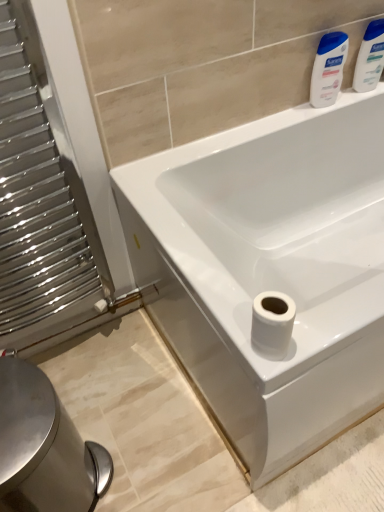
Question: Is white glossy lotion at upper right, positioned as the 2th cleaning product in right-to-left order, at the right side of white glossy bathtub at center?

Choices:
 (A) yes
 (B) no

Answer: (B)

Question: From the image's perspective, is white glossy lotion at upper right, which is counted as the 1th cleaning product, starting from the left, below white glossy bathtub at center?

Choices:
 (A) yes
 (B) no

Answer: (B)

Question: Is white glossy bathtub at center a part of white glossy lotion at upper right, which is counted as the 1th cleaning product, starting from the left?

Choices:
 (A) no
 (B) yes

Answer: (A)

Question: Is white glossy lotion at upper right, positioned as the 2th cleaning product in right-to-left order, facing towards white glossy bathtub at center?

Choices:
 (A) no
 (B) yes

Answer: (A)

Question: Considering the relative sizes of white glossy lotion at upper right, positioned as the 2th cleaning product in right-to-left order, and white glossy bathtub at center in the image provided, is white glossy lotion at upper right, positioned as the 2th cleaning product in right-to-left order, thinner than white glossy bathtub at center?

Choices:
 (A) yes
 (B) no

Answer: (A)

Question: Is polished metal radiator at left to the left or to the right of silver metallic bidet at lower left in the image?

Choices:
 (A) left
 (B) right

Answer: (A)

Question: Considering the positions of polished metal radiator at left and silver metallic bidet at lower left in the image, is polished metal radiator at left wider or thinner than silver metallic bidet at lower left?

Choices:
 (A) wide
 (B) thin

Answer: (B)

Question: Is polished metal radiator at left bigger or smaller than silver metallic bidet at lower left?

Choices:
 (A) small
 (B) big

Answer: (A)

Question: Which is correct: polished metal radiator at left is inside silver metallic bidet at lower left, or outside of it?

Choices:
 (A) outside
 (B) inside

Answer: (A)

Question: From a real-world perspective, is silver metallic bidet at lower left positioned above or below white glossy bathtub at center?

Choices:
 (A) below
 (B) above

Answer: (A)

Question: From the image's perspective, is silver metallic bidet at lower left positioned above or below white glossy bathtub at center?

Choices:
 (A) below
 (B) above

Answer: (A)

Question: Based on their sizes in the image, would you say silver metallic bidet at lower left is bigger or smaller than white glossy bathtub at center?

Choices:
 (A) big
 (B) small

Answer: (B)

Question: From their relative heights in the image, would you say silver metallic bidet at lower left is taller or shorter than white glossy bathtub at center?

Choices:
 (A) short
 (B) tall

Answer: (A)

Question: Do you think polished metal radiator at left is within white glossy bathtub at center, or outside of it?

Choices:
 (A) outside
 (B) inside

Answer: (A)

Question: Is point (29, 131) closer or farther from the camera than point (180, 264)?

Choices:
 (A) farther
 (B) closer

Answer: (A)